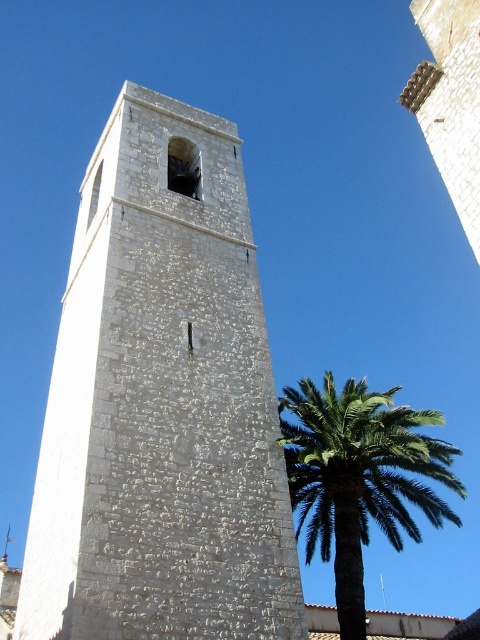
Between point (238, 339) and point (367, 499), which one is positioned behind?

The point (367, 499) is behind.

Can you confirm if white stone bell tower at center is wider than green leafy palm at right?

No, white stone bell tower at center is not wider than green leafy palm at right.

Is point (159, 486) behind point (312, 518)?

No, (159, 486) is in front of (312, 518).

Image resolution: width=480 pixels, height=640 pixels. Find the location of `white stone bell tower at center`. white stone bell tower at center is located at coordinates (160, 404).